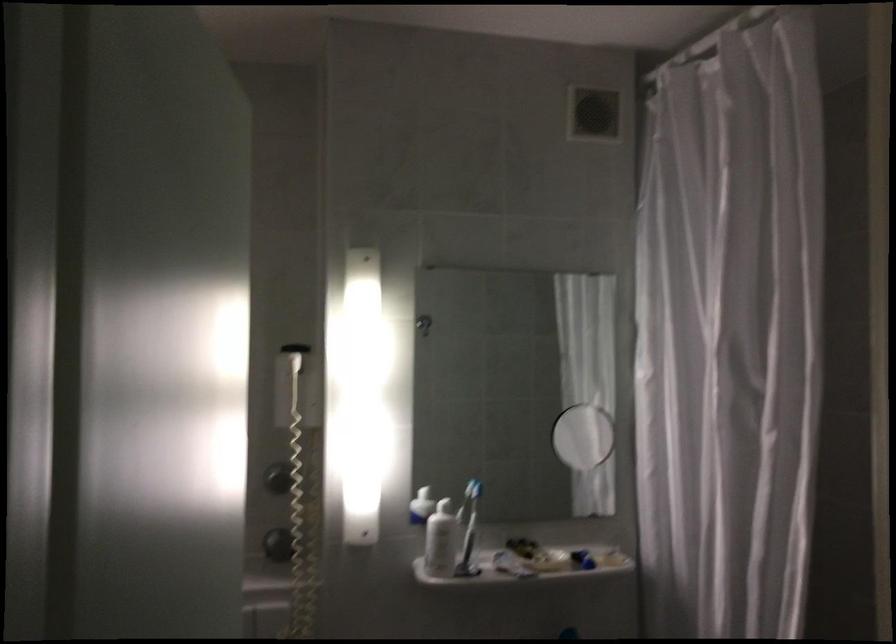
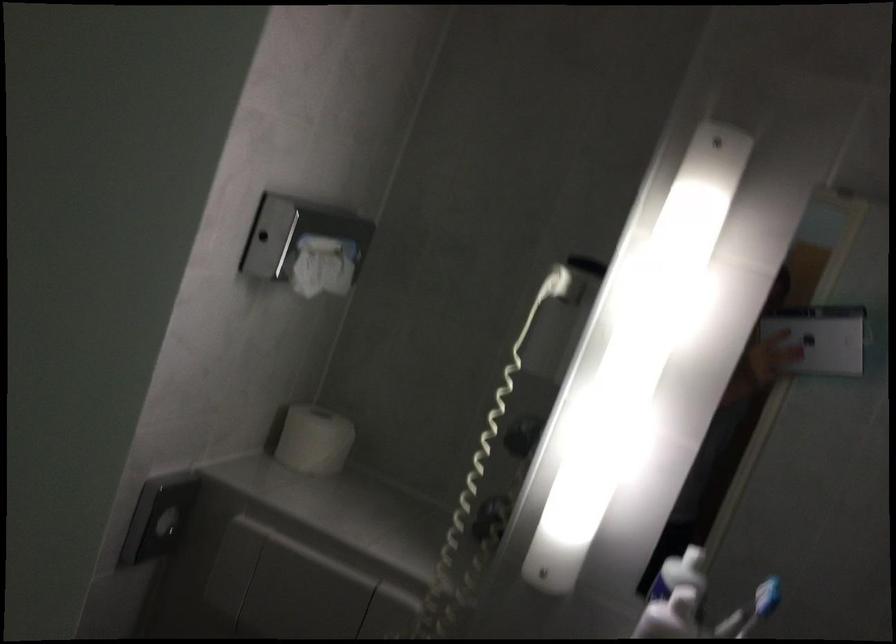
Question: The camera is either moving clockwise (left) or counter-clockwise (right) around the object. The first image is from the beginning of the video and the second image is from the end. Is the camera moving left or right when shooting the video?

Choices:
 (A) Left
 (B) Right

Answer: (B)